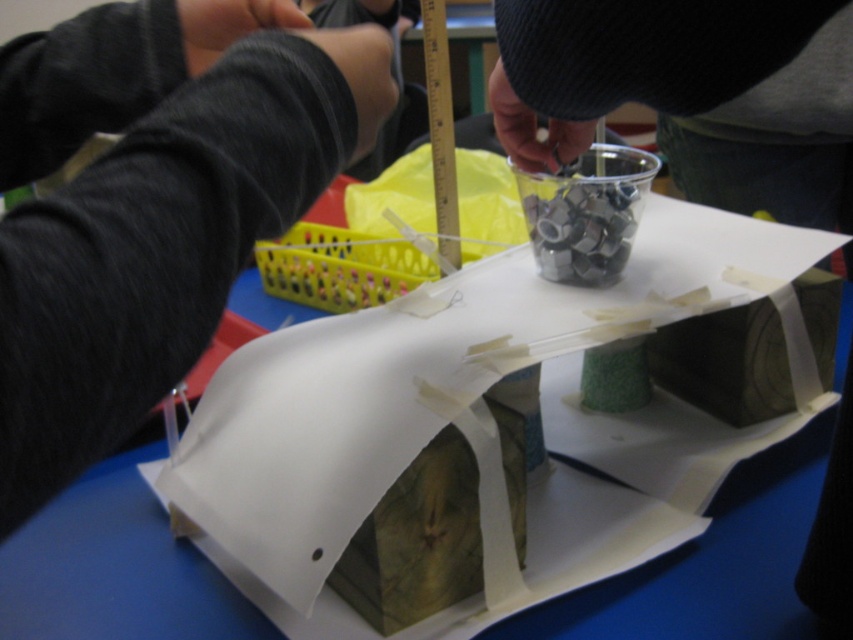
You are holding a 15 cm ruler and want to measure the distance between the black fabric arm at upper left and yourself. Can you do it without moving your hand? Explain.

The distance between the black fabric arm at upper left and the viewer is 19.25 centimeters. Since the ruler is only 15 cm long, it cannot fully measure the 19.25 cm distance. Therefore, you cannot measure the entire distance without moving your hand.

You are an observer looking at the crafting setup. You notice the black fabric arm at upper left and the green textured cup at upper center. Which of these two items is positioned to the right?

The green textured cup at upper center is positioned to the right of the black fabric arm at upper left.

You are an observer looking at the crafting project. You notice the black fabric arm at upper left and the green textured cup at upper center. Which object is positioned lower in the scene?

The black fabric arm at upper left is positioned below the green textured cup at upper center, so it is lower in the scene.